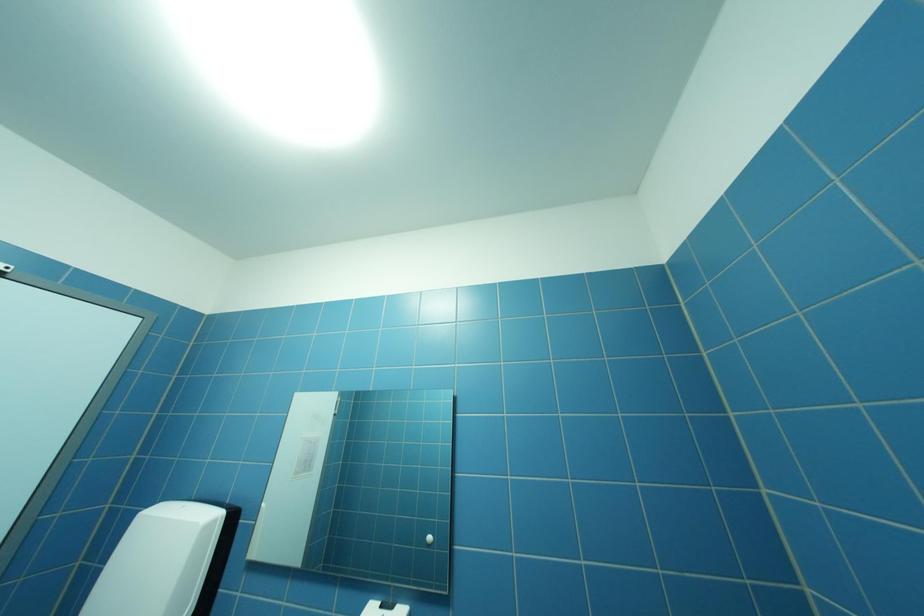
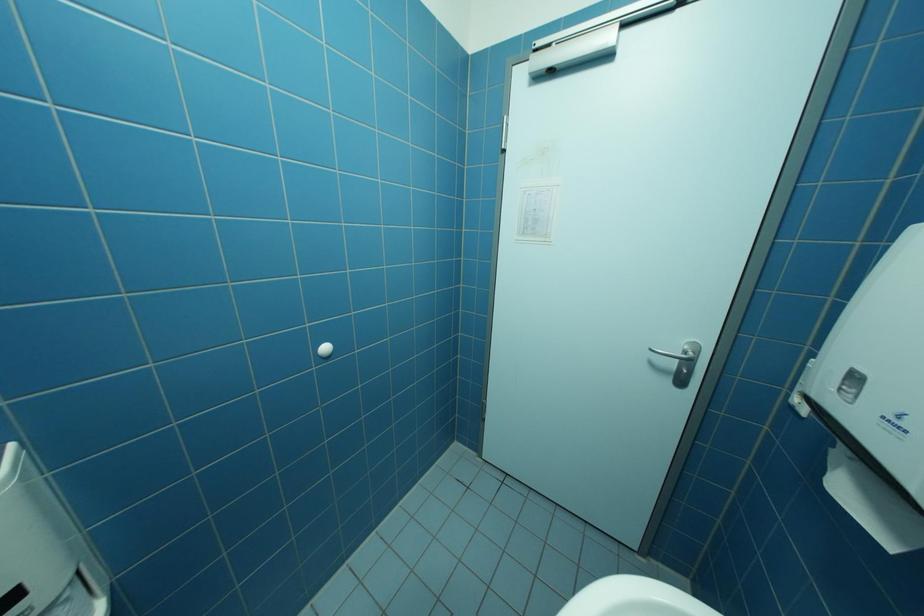
Question: The first image is from the beginning of the video and the second image is from the end. How did the camera likely rotate when shooting the video?

Choices:
 (A) Left
 (B) Right
 (C) Up
 (D) Down

Answer: (A)